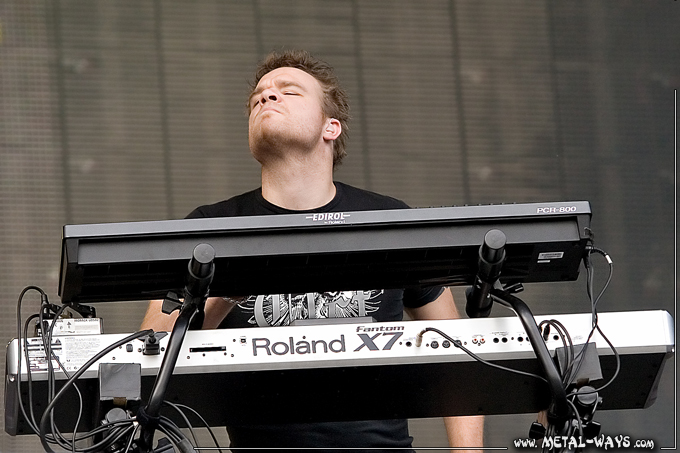
Locate an element on the screen. silver edge of keyboard is located at coordinates point(644,323).